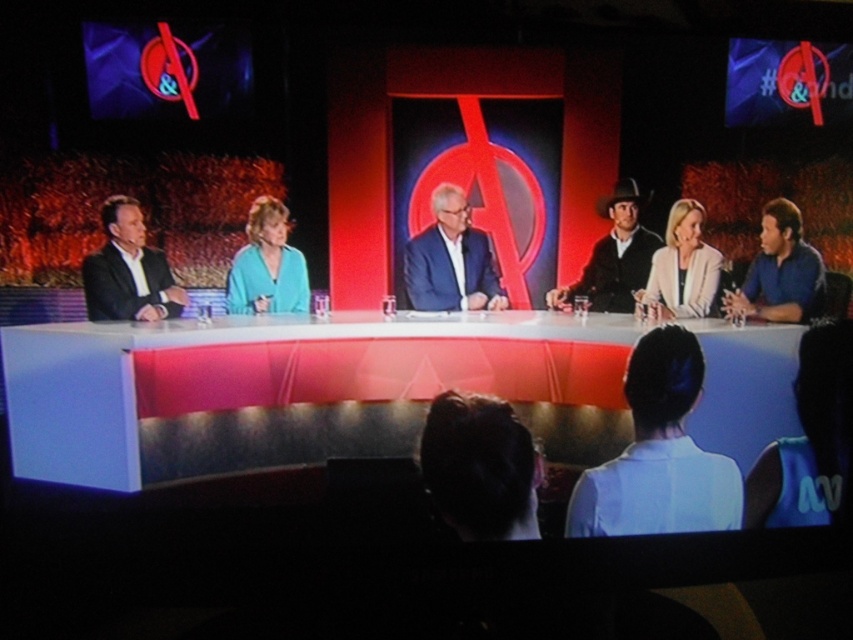
Question: Which object appears closest to the camera in this image?

Choices:
 (A) blue shirt at right
 (B) blue suit at center
 (C) white shirt at lower center
 (D) matte black suit at left

Answer: (D)

Question: Is white shirt at lower center positioned in front of matte black suit at left?

Choices:
 (A) yes
 (B) no

Answer: (B)

Question: Among these points, which one is farthest from the camera?

Choices:
 (A) (595, 280)
 (B) (265, 212)

Answer: (A)

Question: Is blue shirt at right positioned at the back of teal fabric jacket at center?

Choices:
 (A) yes
 (B) no

Answer: (A)

Question: Which object appears closest to the camera in this image?

Choices:
 (A) dark brown hair at lower center
 (B) blue shirt at right
 (C) black leather cowboy hat at center

Answer: (C)

Question: Can you confirm if blue suit at center is smaller than blue shirt at right?

Choices:
 (A) no
 (B) yes

Answer: (A)